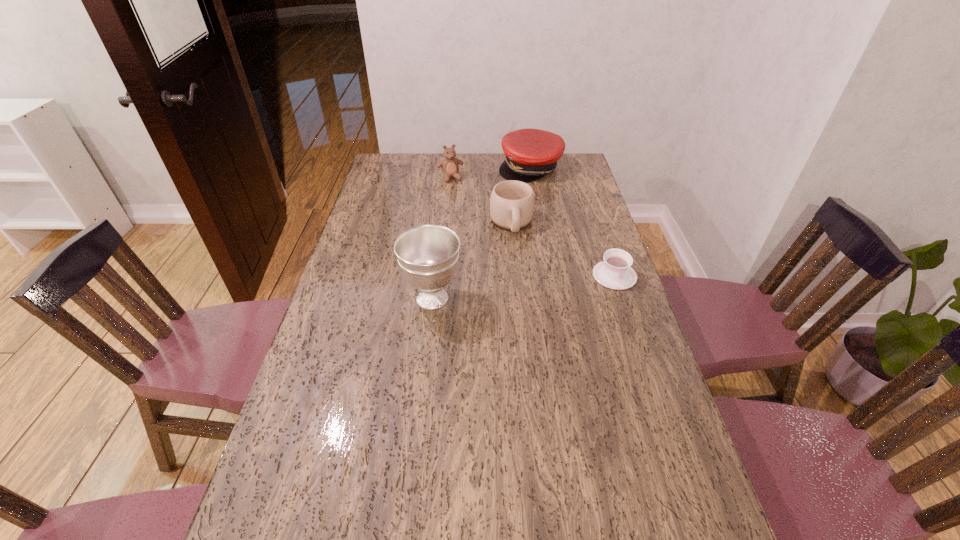
Identify the location of vacant space on the desktop that is between the chalice and the shortest object and is positioned on the front-facing side of the cap. The image size is (960, 540). (546, 284).

This screenshot has height=540, width=960. Identify the location of vacant spot on the desktop that is between the chalice and the rightmost object and is positioned on the side of the third farthest object with the handle. (525, 287).

I want to click on free spot on the desktop that is between the tallest object and the rightmost object and is positioned on the front-facing side of the teddy bear, so click(x=502, y=289).